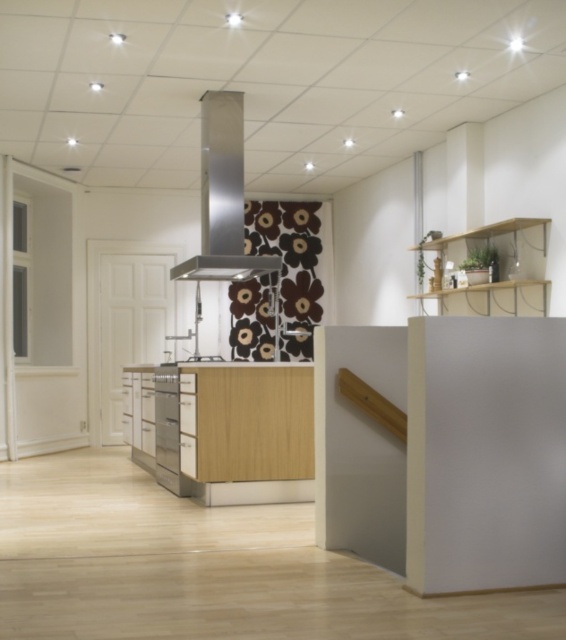
Question: Observing the image, what is the correct spatial positioning of stainless steel exhaust hood at center in reference to satin silver oven at center?

Choices:
 (A) below
 (B) above

Answer: (B)

Question: Is stainless steel exhaust hood at center above satin silver oven at center?

Choices:
 (A) no
 (B) yes

Answer: (B)

Question: Which point appears closest to the camera in this image?

Choices:
 (A) (263, 259)
 (B) (170, 376)

Answer: (B)

Question: Considering the relative positions of stainless steel exhaust hood at center and satin silver oven at center in the image provided, where is stainless steel exhaust hood at center located with respect to satin silver oven at center?

Choices:
 (A) left
 (B) right

Answer: (B)

Question: Which point is closer to the camera?

Choices:
 (A) satin silver oven at center
 (B) stainless steel exhaust hood at center

Answer: (A)